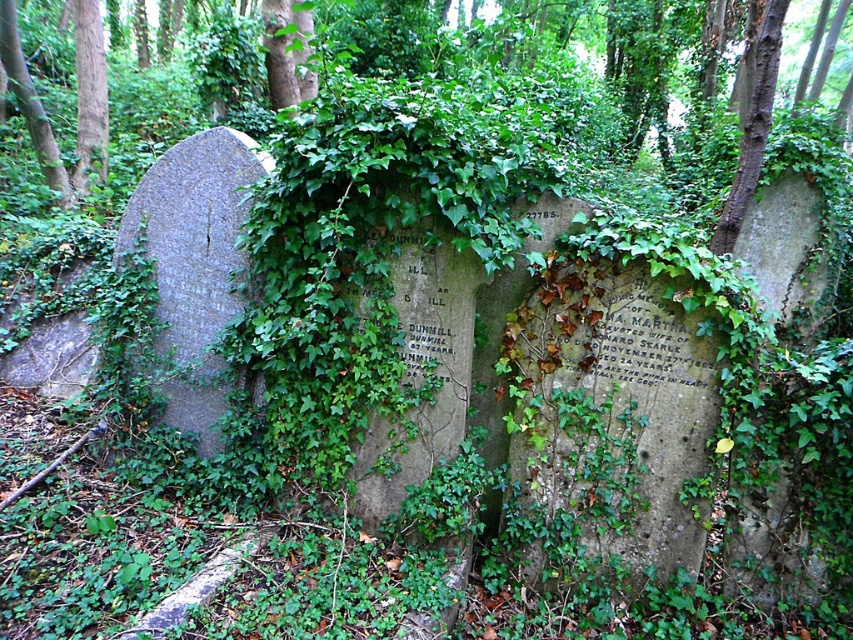
Who is positioned more to the right, brown wood tree at upper left or green leafy tree at left?

brown wood tree at upper left

Is brown wood tree at upper left further to the viewer compared to green leafy tree at left?

Yes, it is.

Who is more forward, (90,44) or (32,99)?

Point (32,99) is more forward.

Locate an element on the screen. The width and height of the screenshot is (853, 640). brown wood tree at upper left is located at coordinates (90, 93).